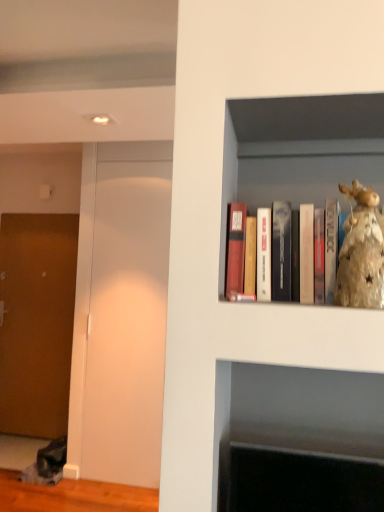
Identify the location of vacant space that is to the left of transparent glass door at left. (71, 490).